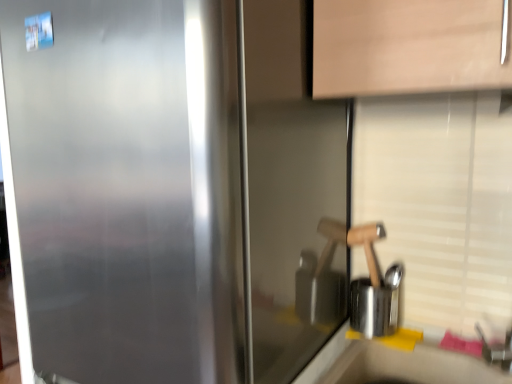
What is the approximate height of wooden handle at right?

The height of wooden handle at right is 6.64 inches.

Where is `satin metallic refrigerator at center`? satin metallic refrigerator at center is located at coordinates (127, 190).

What are the coordinates of `wooden handle at right` in the screenshot? It's located at (351, 244).

Which is in front, point (457, 368) or point (350, 237)?

The point (457, 368) is more forward.

Considering the sizes of objects smooth white countertop at lower right and wooden handle at right in the image provided, who is bigger, smooth white countertop at lower right or wooden handle at right?

smooth white countertop at lower right.

In order to click on door handle above the smooth white countertop at lower right (from a real-world perspective) in this screenshot , I will do `click(351, 244)`.

Does smooth white countertop at lower right have a lesser width compared to wooden handle at right?

In fact, smooth white countertop at lower right might be wider than wooden handle at right.

Looking at this image, is wooden handle at right wider than smooth white countertop at lower right?

No.

Is wooden handle at right aimed at smooth white countertop at lower right?

No, wooden handle at right is not facing towards smooth white countertop at lower right.

Does point (371, 262) come closer to viewer compared to point (378, 353)?

No, (371, 262) is further to viewer.

Is wooden handle at right next to smooth white countertop at lower right and touching it?

No, wooden handle at right is not beside smooth white countertop at lower right.

Which object is more forward, smooth white countertop at lower right or satin metallic refrigerator at center?

satin metallic refrigerator at center is closer to the camera.

Looking at this image, does smooth white countertop at lower right touch satin metallic refrigerator at center?

No, smooth white countertop at lower right is not in contact with satin metallic refrigerator at center.

How many degrees apart are the facing directions of smooth white countertop at lower right and satin metallic refrigerator at center?

2.94e-05 degrees.

Between satin metallic refrigerator at center and smooth white countertop at lower right, which one has smaller size?

Smaller between the two is smooth white countertop at lower right.

Is smooth white countertop at lower right located within satin metallic refrigerator at center?

No, smooth white countertop at lower right is not inside satin metallic refrigerator at center.

From the picture: How much distance is there between satin metallic refrigerator at center and smooth white countertop at lower right?

satin metallic refrigerator at center is 53.72 centimeters away from smooth white countertop at lower right.

Does satin metallic refrigerator at center touch smooth white countertop at lower right?

satin metallic refrigerator at center is not next to smooth white countertop at lower right, and they're not touching.

Locate an element on the screen. refrigerator located on the left of wooden handle at right is located at coordinates (127, 190).

Are satin metallic refrigerator at center and wooden handle at right located far from each other?

No, satin metallic refrigerator at center is not far away from wooden handle at right.

Measure the distance from satin metallic refrigerator at center to wooden handle at right.

satin metallic refrigerator at center and wooden handle at right are 16.85 inches apart.

Is satin metallic refrigerator at center positioned in front of wooden handle at right?

Yes, satin metallic refrigerator at center is closer to the viewer.

Considering the positions of objects wooden handle at right and satin metallic refrigerator at center in the image provided, who is more to the left, wooden handle at right or satin metallic refrigerator at center?

Positioned to the left is satin metallic refrigerator at center.

Can you tell me how much wooden handle at right and satin metallic refrigerator at center differ in facing direction?

0.000111 degrees separate the facing orientations of wooden handle at right and satin metallic refrigerator at center.

Would you say wooden handle at right is outside satin metallic refrigerator at center?

wooden handle at right is positioned outside satin metallic refrigerator at center.

Considering the relative sizes of wooden handle at right and satin metallic refrigerator at center in the image provided, is wooden handle at right wider than satin metallic refrigerator at center?

No, wooden handle at right is not wider than satin metallic refrigerator at center.

I want to click on counter top in front of the wooden handle at right, so click(x=409, y=366).

Where is `door handle above the smooth white countertop at lower right (from the image's perspective)`? door handle above the smooth white countertop at lower right (from the image's perspective) is located at coordinates (351, 244).

Which object lies nearer to the anchor point satin metallic refrigerator at center, wooden handle at right or smooth white countertop at lower right?

The object closer to satin metallic refrigerator at center is wooden handle at right.

Looking at the image, which one is located further to smooth white countertop at lower right, satin metallic refrigerator at center or wooden handle at right?

satin metallic refrigerator at center is positioned further to the anchor smooth white countertop at lower right.

When comparing their distances from satin metallic refrigerator at center, does smooth white countertop at lower right or wooden handle at right seem further?

The object further to satin metallic refrigerator at center is smooth white countertop at lower right.

Estimate the real-world distances between objects in this image. Which object is closer to wooden handle at right, satin metallic refrigerator at center or smooth white countertop at lower right?

smooth white countertop at lower right.

Which object lies further to the anchor point wooden handle at right, smooth white countertop at lower right or satin metallic refrigerator at center?

The object further to wooden handle at right is satin metallic refrigerator at center.

Estimate the real-world distances between objects in this image. Which object is further from smooth white countertop at lower right, wooden handle at right or satin metallic refrigerator at center?

The object further to smooth white countertop at lower right is satin metallic refrigerator at center.

Where is `counter top between satin metallic refrigerator at center and wooden handle at right along the z-axis`? counter top between satin metallic refrigerator at center and wooden handle at right along the z-axis is located at coordinates (409, 366).